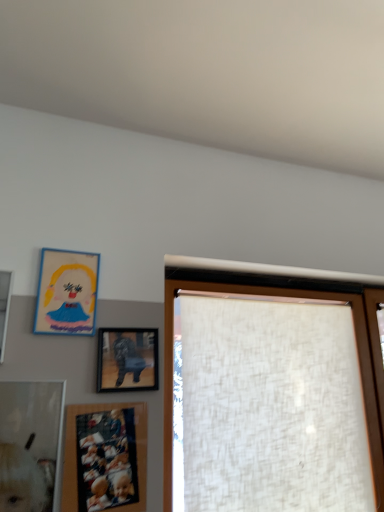
Question: From a real-world perspective, is matte cardboard picture frame at upper left, the second picture frame viewed from the left, on matte wooden picture frame at lower left, the 3th picture frame positioned from the left?

Choices:
 (A) yes
 (B) no

Answer: (A)

Question: Is matte cardboard picture frame at upper left, which appears as the third picture frame when viewed from the right, to the left of matte wooden picture frame at lower left, placed as the 2th picture frame when sorted from right to left, from the viewer's perspective?

Choices:
 (A) yes
 (B) no

Answer: (A)

Question: Is the depth of matte cardboard picture frame at upper left, which appears as the third picture frame when viewed from the right, greater than that of matte wooden picture frame at lower left, placed as the 2th picture frame when sorted from right to left?

Choices:
 (A) yes
 (B) no

Answer: (A)

Question: Considering the relative positions of matte cardboard picture frame at upper left, the second picture frame viewed from the left, and matte wooden picture frame at lower left, placed as the 2th picture frame when sorted from right to left, in the image provided, is matte cardboard picture frame at upper left, the second picture frame viewed from the left, to the right of matte wooden picture frame at lower left, placed as the 2th picture frame when sorted from right to left, from the viewer's perspective?

Choices:
 (A) no
 (B) yes

Answer: (A)

Question: Is matte cardboard picture frame at upper left, the second picture frame viewed from the left, smaller than matte wooden picture frame at lower left, the 3th picture frame positioned from the left?

Choices:
 (A) no
 (B) yes

Answer: (B)

Question: Is matte black picture frame at center, which ranks as the 4th picture frame in left-to-right order, spatially inside matte wooden picture frame at lower left, the 3th picture frame positioned from the left, or outside of it?

Choices:
 (A) outside
 (B) inside

Answer: (A)

Question: Is matte black picture frame at center, which ranks as the 4th picture frame in left-to-right order, taller or shorter than matte wooden picture frame at lower left, placed as the 2th picture frame when sorted from right to left?

Choices:
 (A) tall
 (B) short

Answer: (B)

Question: Considering the positions of matte black picture frame at center, which ranks as the 4th picture frame in left-to-right order, and matte wooden picture frame at lower left, placed as the 2th picture frame when sorted from right to left, in the image, is matte black picture frame at center, which ranks as the 4th picture frame in left-to-right order, wider or thinner than matte wooden picture frame at lower left, placed as the 2th picture frame when sorted from right to left,?

Choices:
 (A) wide
 (B) thin

Answer: (A)

Question: In the image, is matte black picture frame at center, which is counted as the 1th picture frame, starting from the right, on the left side or the right side of matte wooden picture frame at lower left, placed as the 2th picture frame when sorted from right to left?

Choices:
 (A) left
 (B) right

Answer: (B)

Question: Considering the positions of matte wooden picture frame at lower left, placed as the 2th picture frame when sorted from right to left, and white textured curtain at right in the image, is matte wooden picture frame at lower left, placed as the 2th picture frame when sorted from right to left, taller or shorter than white textured curtain at right?

Choices:
 (A) tall
 (B) short

Answer: (B)

Question: Is point (64, 506) closer or farther from the camera than point (165, 320)?

Choices:
 (A) farther
 (B) closer

Answer: (B)

Question: Would you say matte wooden picture frame at lower left, placed as the 2th picture frame when sorted from right to left, is to the left or to the right of white textured curtain at right in the picture?

Choices:
 (A) left
 (B) right

Answer: (A)

Question: From the image's perspective, is matte wooden picture frame at lower left, placed as the 2th picture frame when sorted from right to left, located above or below white textured curtain at right?

Choices:
 (A) above
 (B) below

Answer: (B)

Question: Looking at their shapes, would you say matte wooden picture frame at upper left, arranged as the fourth picture frame when viewed from the right, is wider or thinner than matte wooden picture frame at lower left, the 3th picture frame positioned from the left?

Choices:
 (A) wide
 (B) thin

Answer: (A)

Question: From a real-world perspective, relative to matte wooden picture frame at lower left, placed as the 2th picture frame when sorted from right to left, is matte wooden picture frame at upper left, arranged as the 1th picture frame when viewed from the left, vertically above or below?

Choices:
 (A) above
 (B) below

Answer: (A)